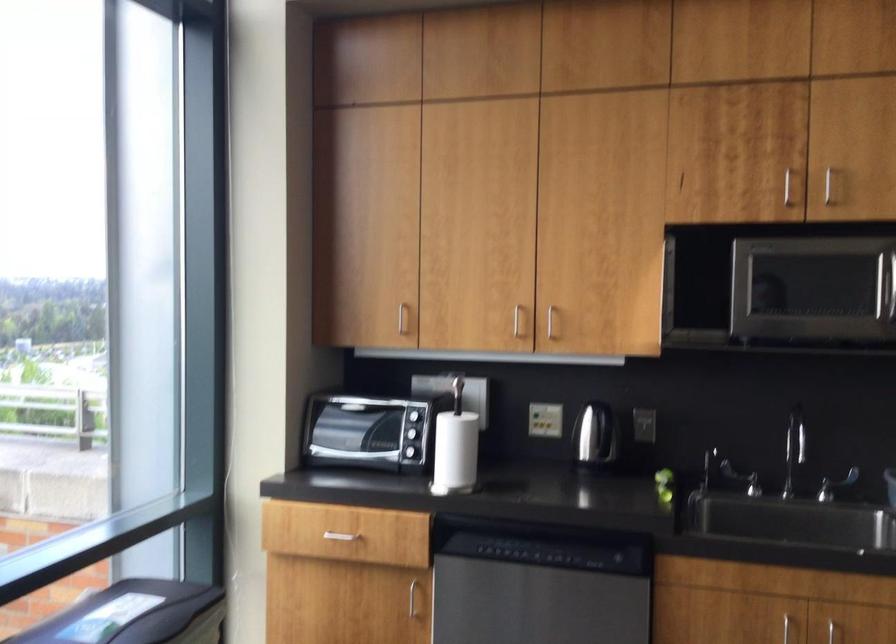
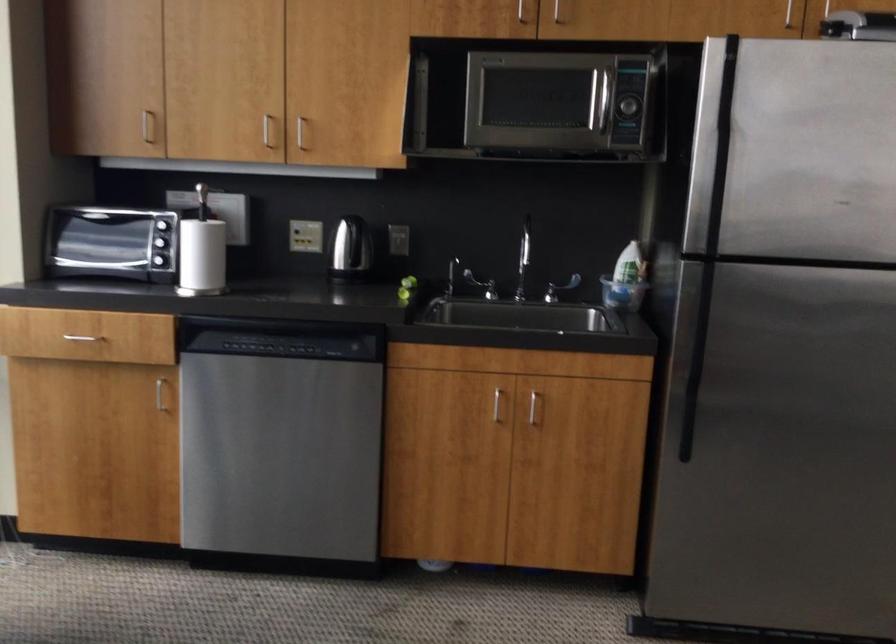
Where in the second image is the point corresponding to (x=338, y=534) from the first image?

(82, 337)